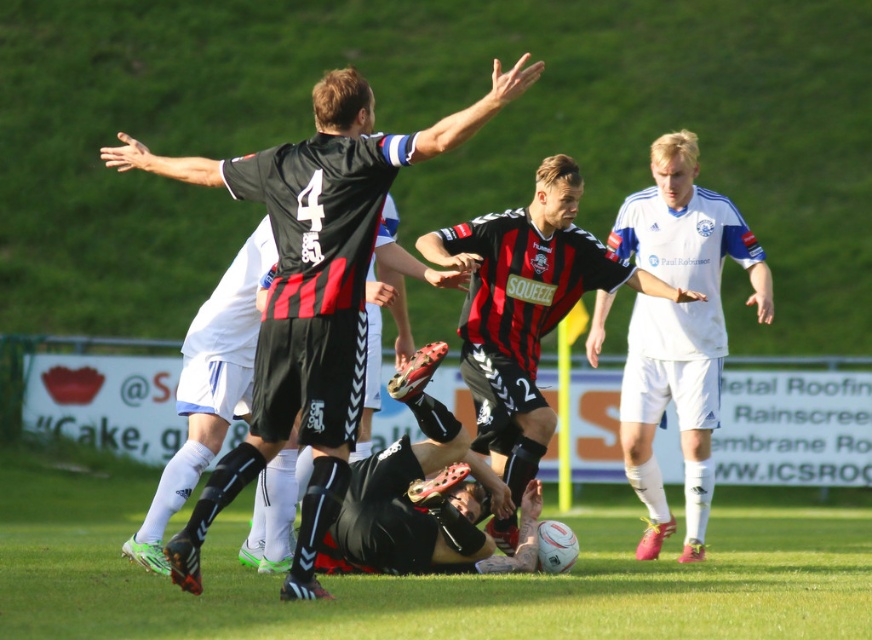
Who is positioned more to the right, white smooth soccer player at right or black jersey at center?

white smooth soccer player at right is more to the right.

Is white smooth soccer player at right smaller than black jersey at center?

Correct, white smooth soccer player at right occupies less space than black jersey at center.

Between point (624, 432) and point (556, 188), which one is positioned behind?

The point (624, 432) is more distant.

I want to click on white smooth soccer player at right, so click(x=679, y=330).

Is black matte jersey at center in front of white smooth soccer player at right?

Yes, black matte jersey at center is in front of white smooth soccer player at right.

What do you see at coordinates (312, 291) in the screenshot? Image resolution: width=872 pixels, height=640 pixels. I see `black matte jersey at center` at bounding box center [312, 291].

Is point (296, 211) farther from viewer compared to point (603, 301)?

No, (296, 211) is closer to viewer.

Identify the location of black matte jersey at center. This screenshot has width=872, height=640. (312, 291).

Can you confirm if black matte jersey at center is positioned to the left of black jersey at center?

Indeed, black matte jersey at center is positioned on the left side of black jersey at center.

Is point (346, 216) positioned behind point (474, 268)?

No, (346, 216) is in front of (474, 268).

Between point (261, 440) and point (481, 301), which one is positioned behind?

The point (481, 301) is behind.

Locate an element on the screen. The width and height of the screenshot is (872, 640). black matte jersey at center is located at coordinates (312, 291).